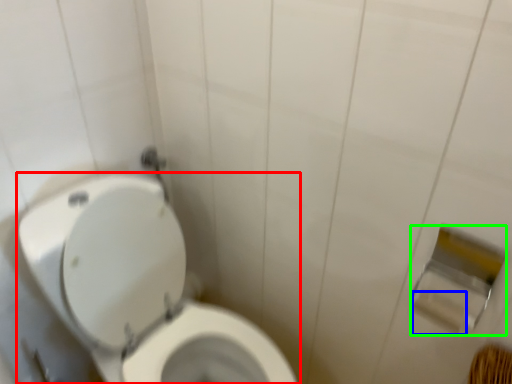
Question: Based on their relative distances, which object is farther from toilet (highlighted by a red box)? Choose from toilet paper (highlighted by a blue box) and toilet paper (highlighted by a green box).

Choices:
 (A) toilet paper
 (B) toilet paper

Answer: (A)